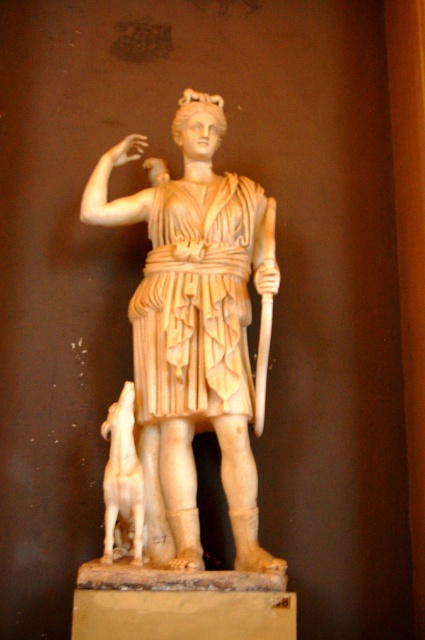
Question: Is white marble statue at center to the right of matte beige dog at lower left from the viewer's perspective?

Choices:
 (A) yes
 (B) no

Answer: (A)

Question: Which point is closer to the camera?

Choices:
 (A) white marble statue at center
 (B) matte beige dog at lower left

Answer: (A)

Question: Which object appears closest to the camera in this image?

Choices:
 (A) matte beige dog at lower left
 (B) white marble statue at center

Answer: (B)

Question: Is white marble statue at center above matte beige dog at lower left?

Choices:
 (A) yes
 (B) no

Answer: (A)

Question: Does white marble statue at center appear on the left side of matte beige dog at lower left?

Choices:
 (A) yes
 (B) no

Answer: (B)